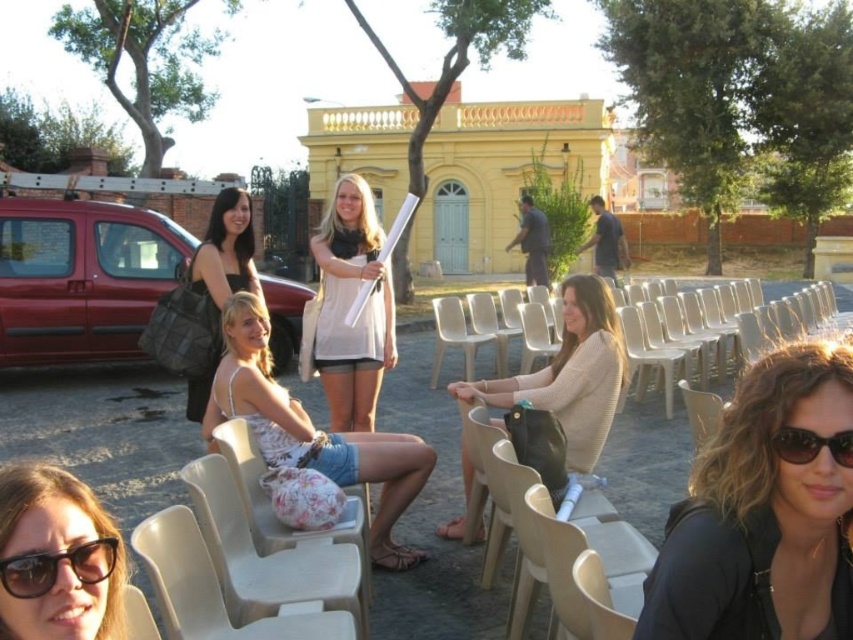
Does matte black sunglasses at lower left have a greater height compared to white matte dress at center?

In fact, matte black sunglasses at lower left may be shorter than white matte dress at center.

The height and width of the screenshot is (640, 853). Find the location of `matte black sunglasses at lower left`. matte black sunglasses at lower left is located at coordinates [x=59, y=557].

Does white matte dress at center appear under black plastic sunglasses at lower right?

No, white matte dress at center is not below black plastic sunglasses at lower right.

Who is more distant from viewer, (358, 388) or (817, 442)?

The point (358, 388) is more distant.

Where is `white matte dress at center`? white matte dress at center is located at coordinates (347, 307).

Based on the photo, can you confirm if white matte dress at center is thinner than beige plastic chair at center?

No.

Consider the image. Is white matte dress at center positioned in front of beige plastic chair at center?

Yes, white matte dress at center is closer to the viewer.

Does point (366, 401) come closer to viewer compared to point (433, 364)?

Yes, point (366, 401) is closer to viewer.

Where is `white matte dress at center`? The height and width of the screenshot is (640, 853). white matte dress at center is located at coordinates (347, 307).